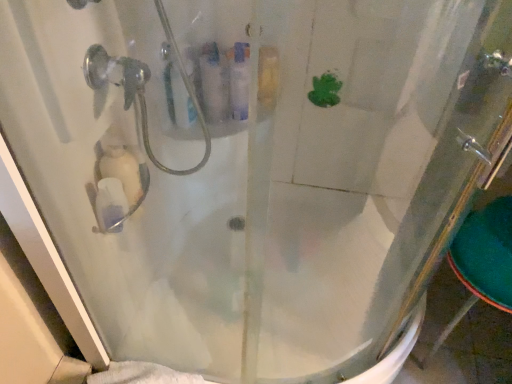
Describe the element at coordinates (482, 262) in the screenshot. I see `green fabric chair at lower right` at that location.

Identify the location of green fabric chair at lower right. This screenshot has width=512, height=384. (482, 262).

Identify the location of green fabric chair at lower right. Image resolution: width=512 pixels, height=384 pixels. pyautogui.click(x=482, y=262).